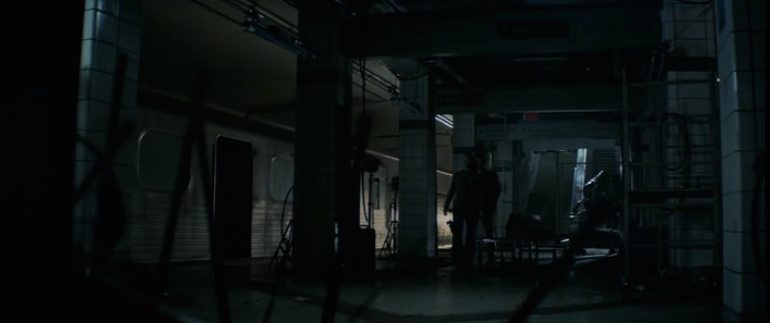
What are the coordinates of `dark area near ceiling` in the screenshot? It's located at (504, 24).